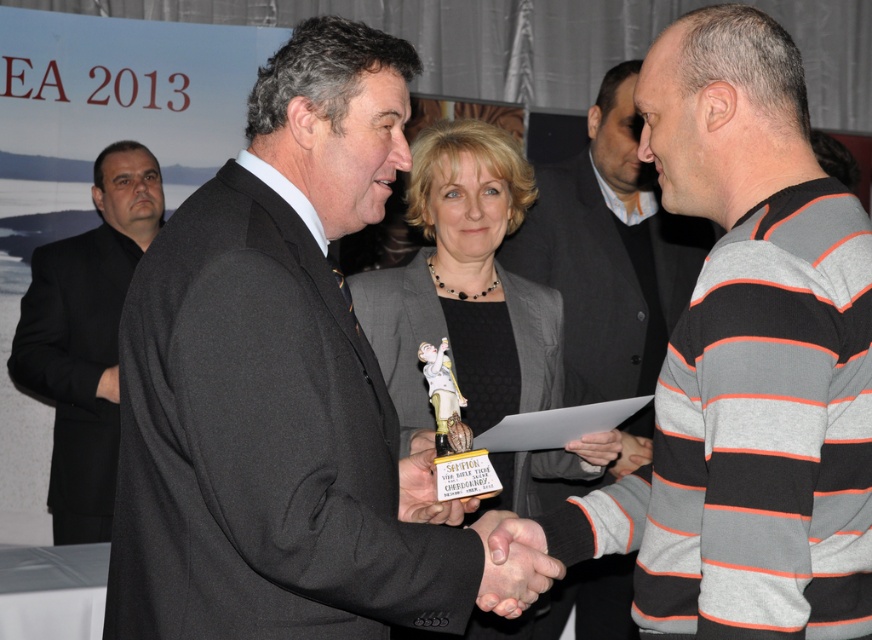
Question: Estimate the real-world distances between objects in this image. Which object is closer to the matte black suit at center?

Choices:
 (A) gray striped sweater at center
 (B) matte gray blazer at center
 (C) black matte suit at left

Answer: (B)

Question: Is black matte suit at left wider than smooth skin handshake at center?

Choices:
 (A) yes
 (B) no

Answer: (A)

Question: In this image, where is black matte suit at left located relative to metallic gold trophy at center?

Choices:
 (A) right
 (B) left

Answer: (B)

Question: Can you confirm if black matte suit at left is positioned to the right of metallic gold trophy at center?

Choices:
 (A) yes
 (B) no

Answer: (B)

Question: Which point appears closest to the camera in this image?

Choices:
 (A) (402, 67)
 (B) (637, 451)
 (C) (94, 332)
 (D) (509, 196)

Answer: (A)

Question: Considering the real-world distances, which object is farthest from the gray striped sweater at center?

Choices:
 (A) black matte suit at left
 (B) smooth skin handshake at center

Answer: (B)